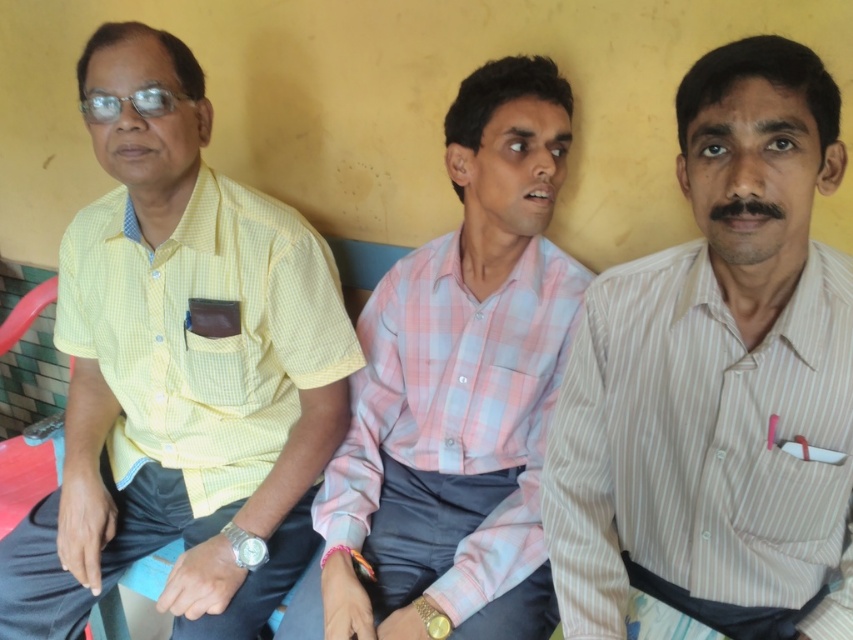
Question: Among these points, which one is farthest from the camera?

Choices:
 (A) (x=199, y=484)
 (B) (x=643, y=522)

Answer: (A)

Question: Does yellow checkered shirt at left have a smaller size compared to pink checkered shirt at center?

Choices:
 (A) no
 (B) yes

Answer: (A)

Question: Which point is farther to the camera?

Choices:
 (A) (534, 436)
 (B) (161, 522)

Answer: (B)

Question: In this image, where is yellow checkered shirt at left located relative to pink checkered shirt at center?

Choices:
 (A) above
 (B) below

Answer: (A)

Question: Does white striped shirt at center appear on the left side of pink checkered shirt at center?

Choices:
 (A) yes
 (B) no

Answer: (B)

Question: Which object is positioned closest to the pink checkered shirt at center?

Choices:
 (A) white striped shirt at center
 (B) yellow checkered shirt at left

Answer: (B)